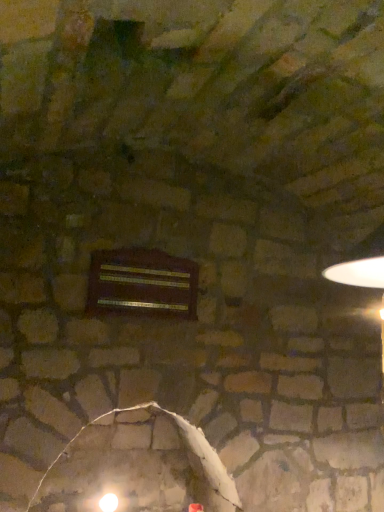
This screenshot has width=384, height=512. I want to click on brown wooden sign at center, so click(142, 284).

What do you see at coordinates (142, 284) in the screenshot? The height and width of the screenshot is (512, 384). I see `brown wooden sign at center` at bounding box center [142, 284].

This screenshot has width=384, height=512. I want to click on brown wooden sign at center, so click(x=142, y=284).